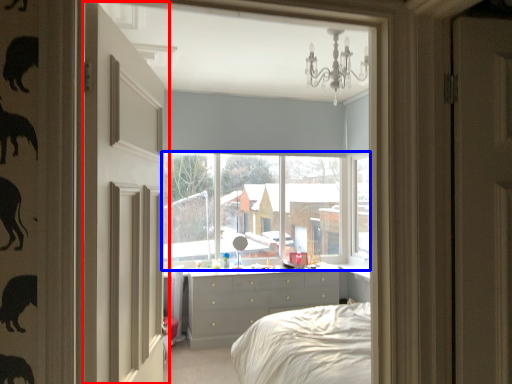
Question: Which point is closer to the camera, door (highlighted by a red box) or window (highlighted by a blue box)?

Choices:
 (A) door
 (B) window

Answer: (A)